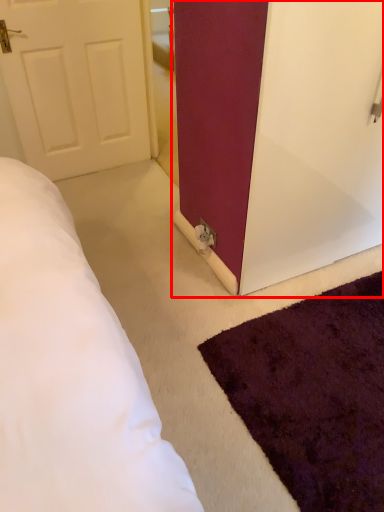
Question: From the image's perspective, considering the relative positions of door (annotated by the red box) and mat in the image provided, where is door (annotated by the red box) located with respect to the staircase?

Choices:
 (A) below
 (B) above

Answer: (B)